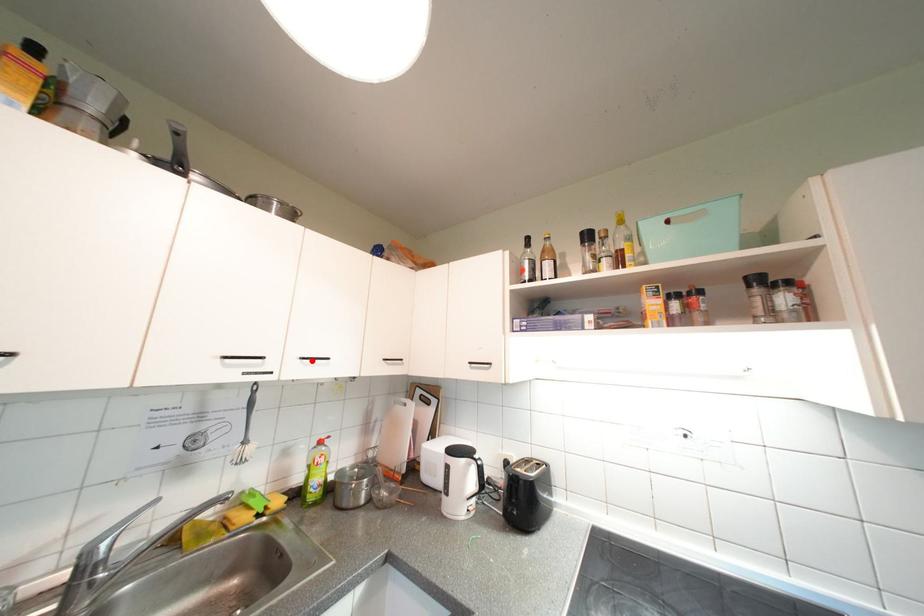
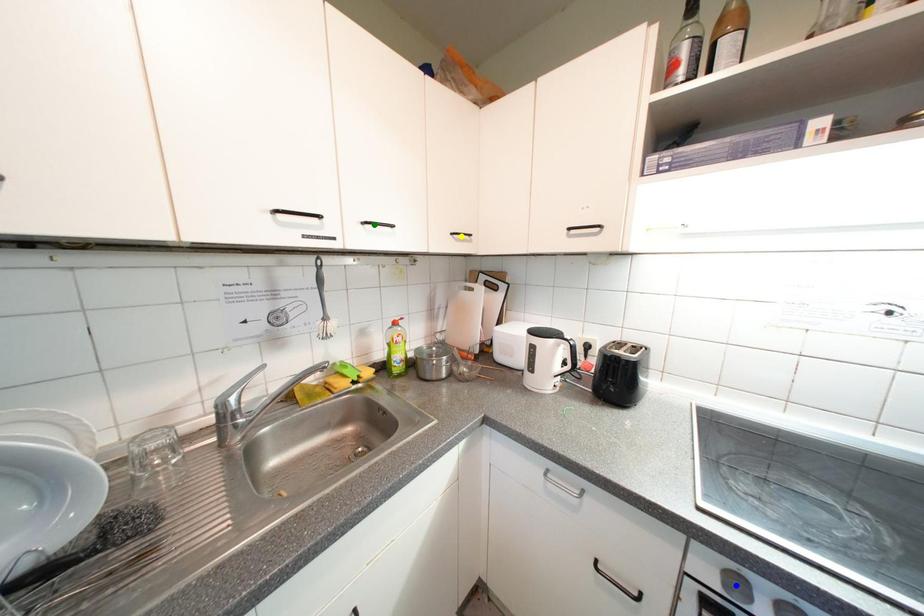
Question: I am providing you with two images of the same scene from different viewpoints. A red point is marked on the first image. You are given multiple points on the second image. In image 2, which mark is for the same physical point as the one in image 1?

Choices:
 (A) blue point
 (B) green point
 (C) yellow point

Answer: (B)